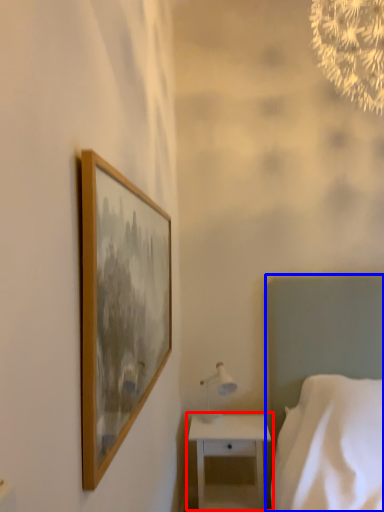
Question: Among these objects, which one is nearest to the camera, nightstand (highlighted by a red box) or bed (highlighted by a blue box)?

Choices:
 (A) nightstand
 (B) bed

Answer: (B)